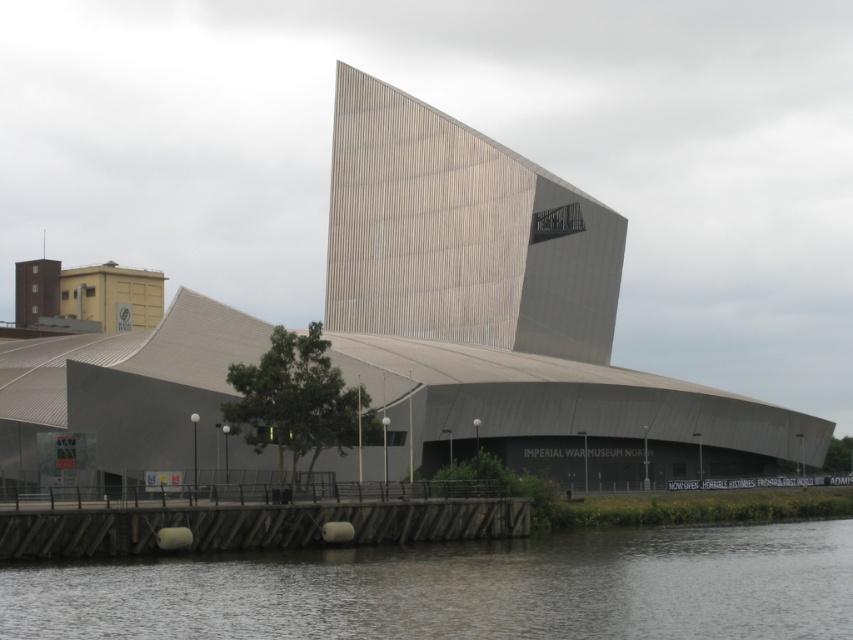
Who is lower down, dark gray water at lower center or gray textured building at center?

dark gray water at lower center is below.

Is dark gray water at lower center wider than gray textured building at center?

Yes.

Is point (630, 621) positioned in front of point (440, 193)?

Yes.

The width and height of the screenshot is (853, 640). I want to click on dark gray water at lower center, so click(x=463, y=588).